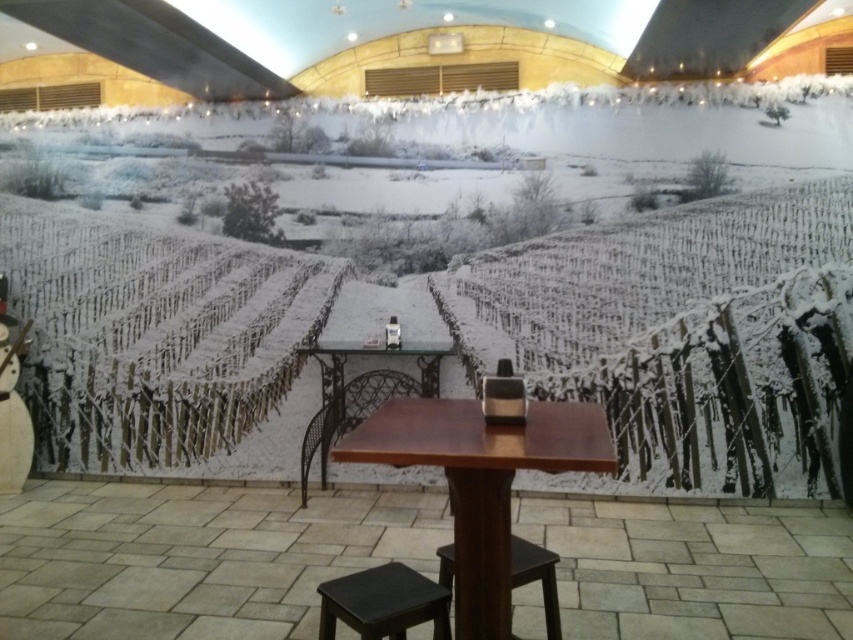
You are standing in the snowy vineyard themed room and want to sit down. Which object, the wooden table at center or the dark brown wooden stool at lower center, is closer to you?

The wooden table at center is closer to you than the dark brown wooden stool at lower center.